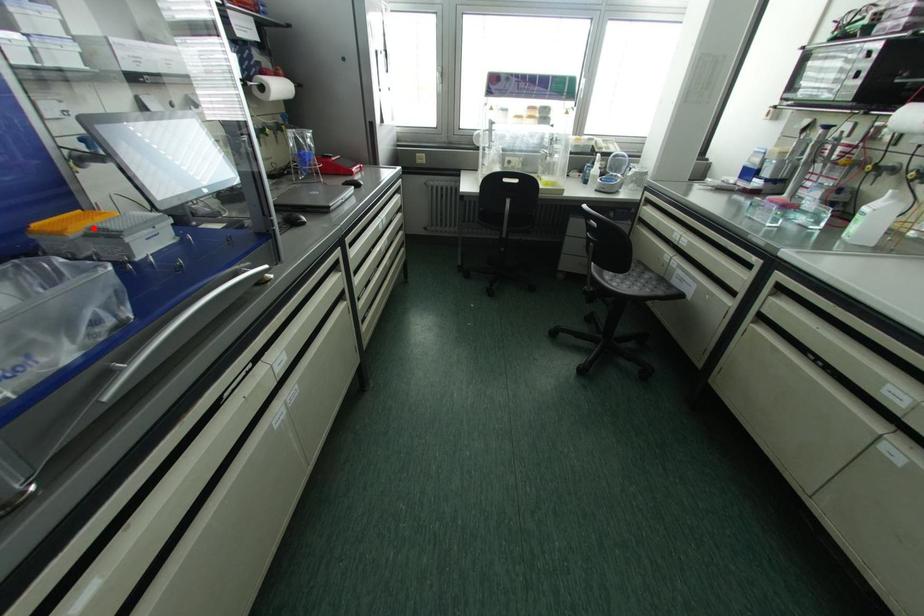
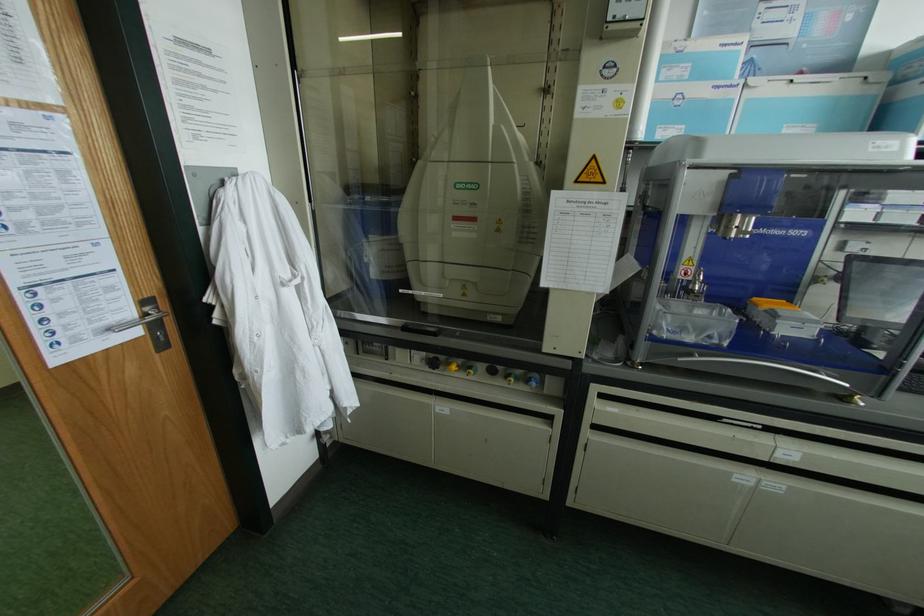
Where in the second image is the point corresponding to the highlighted location from the first image?

(772, 310)